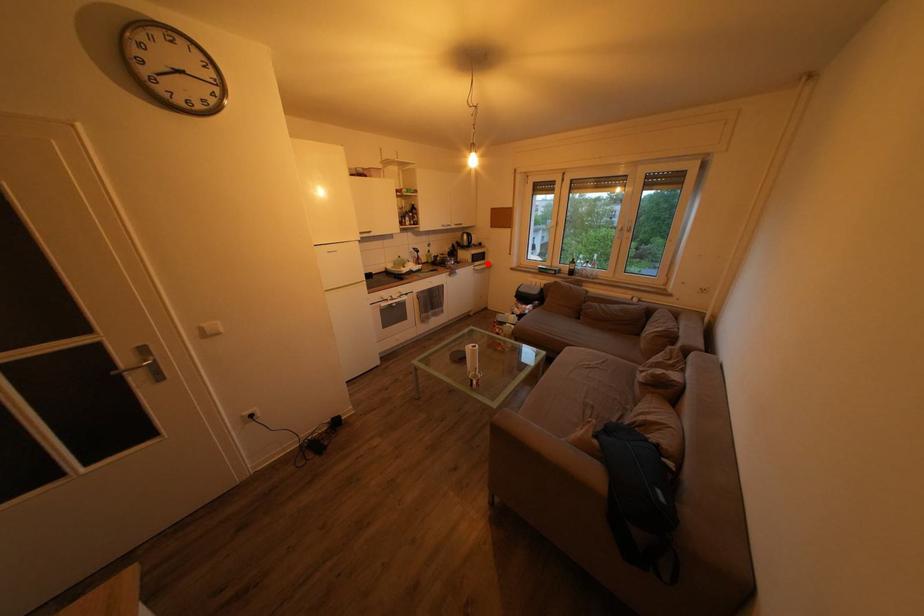
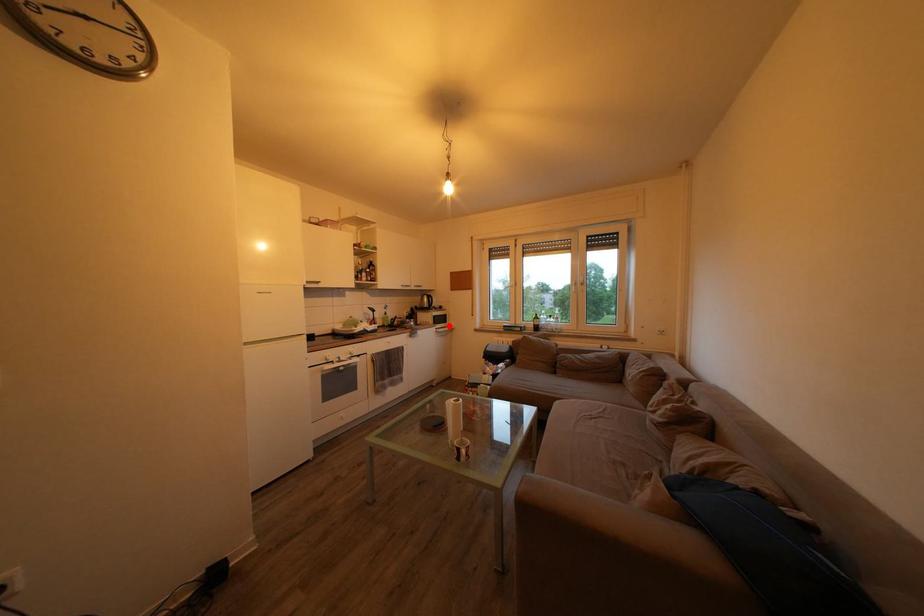
I am providing you with two images of the same scene from different viewpoints. A red point is marked on the first image and another point is marked on the second image. Is the red point in image1 aligned with the point shown in image2?

Yes